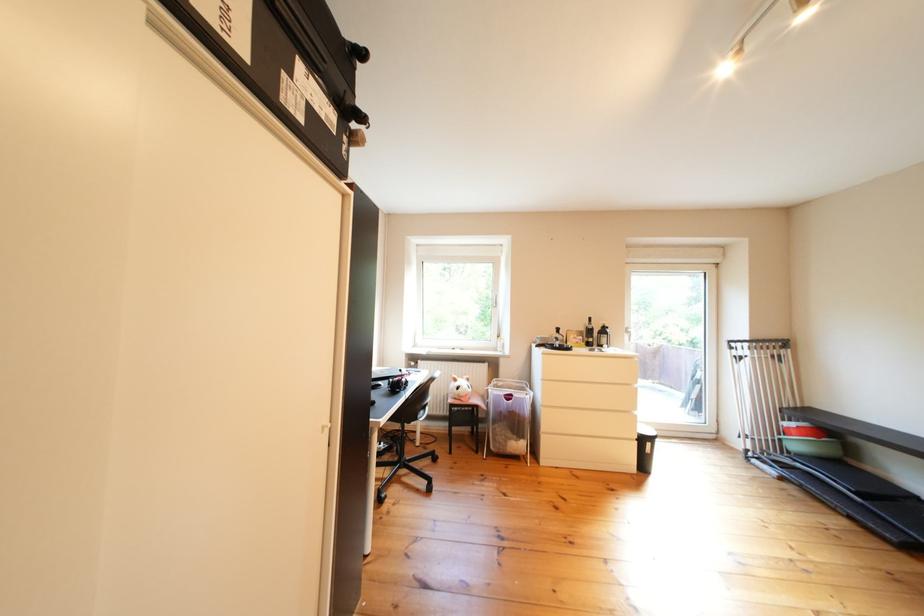
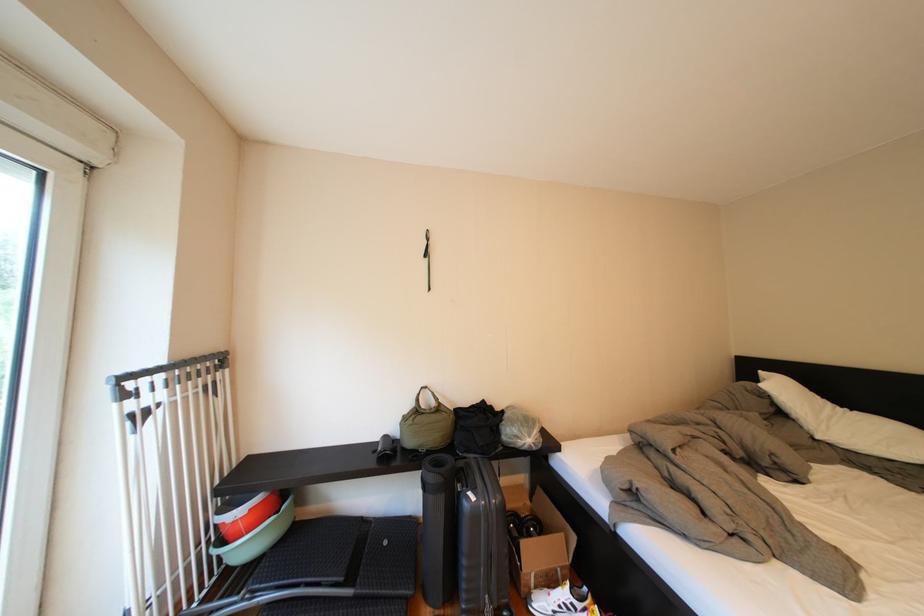
Where in the second image is the point corresponding to the point at 812,451 from the first image?

(261, 551)